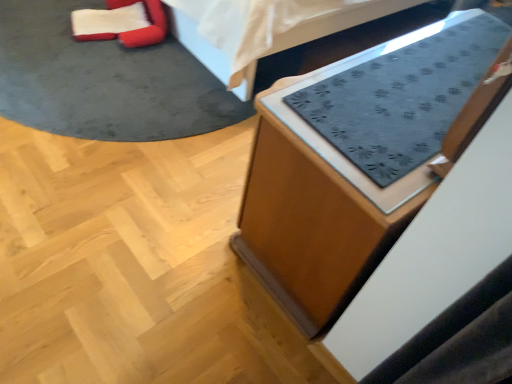
At what (x,y) coordinates should I click in order to perform the action: click on unoccupied area in front of velvet red bean bag chair at upper left. Please return your answer as a coordinate pair (x, y). Looking at the image, I should click on (84, 76).